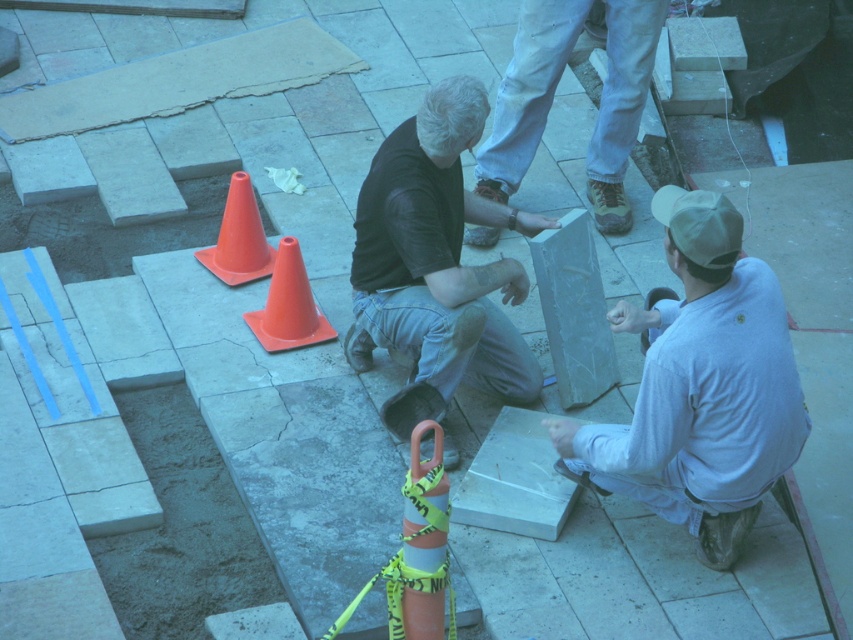
You are a construction worker who needs to place a safety barrier between the white marble slab at lower right and the orange plastic cone at center. Which object should you place the barrier closer to to ensure it doesn

The orange plastic cone at center is smaller than the white marble slab at lower right. Since the barrier needs to be placed between them, positioning it closer to the smaller object would help maintain balance and safety. Therefore, place the barrier closer to the orange plastic cone at center.

You are a construction worker standing at point [296,275]. You need to move to point [654,465] to check the alignment of the stone tiles. Is the point you need to reach in front of or behind your current position?

Point [654,465] is in front of point [296,275], so the point you need to reach is in front of your current position.